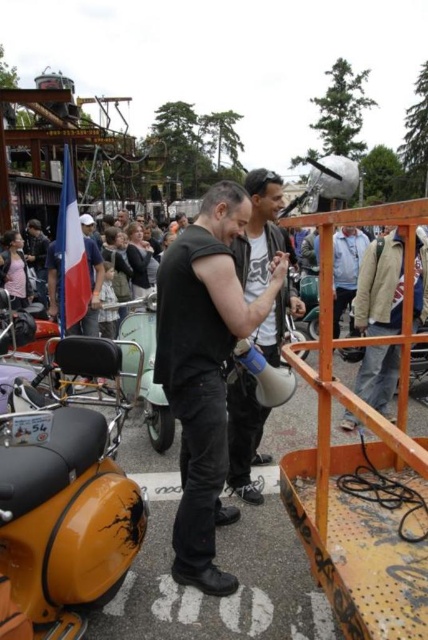
Which is behind, point (163, 314) or point (335, 276)?

Positioned behind is point (335, 276).

Can you confirm if black matte vest at center is taller than light gray jacket at center?

Correct, black matte vest at center is much taller as light gray jacket at center.

Does point (204, 461) come closer to viewer compared to point (344, 244)?

Yes, it is in front of point (344, 244).

Where is `black matte vest at center`? The height and width of the screenshot is (640, 428). black matte vest at center is located at coordinates (205, 369).

Who is more distant from viewer, [41,513] or [219,440]?

The point [219,440] is behind.

Is point (53, 452) in front of point (175, 548)?

Yes.

The image size is (428, 640). What are the coordinates of `yellow matte tank at lower left` in the screenshot? It's located at (64, 513).

Can you confirm if yellow matte tank at lower left is smaller than matte black megaphone at center?

No.

Can you confirm if yellow matte tank at lower left is positioned below matte black megaphone at center?

A: Yes, yellow matte tank at lower left is below matte black megaphone at center.

Is point (2, 492) positioned after point (265, 193)?

No, (2, 492) is in front of (265, 193).

Where is `yellow matte tank at lower left`? yellow matte tank at lower left is located at coordinates coord(64,513).